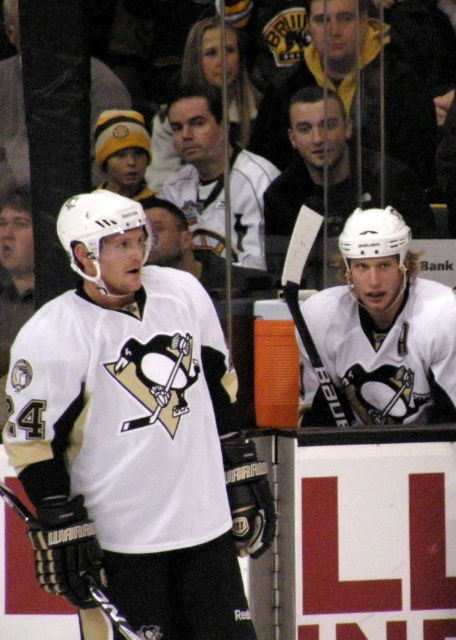
You are a photographer at the ice hockey game. You want to capture a photo where the white matte jersey at left and the black matte hockey stick at upper center are both visible. Based on their positions, which object should appear higher in the photo?

The black matte hockey stick at upper center should appear higher in the photo because the white matte jersey at left is below it.

In the ice hockey game scene, you see the white matte jersey at left and the white matte helmet at upper center. Which object is positioned more to the left side of the image?

The white matte jersey at left is positioned more to the left side of the image than the white matte helmet at upper center.

You are a photographer trying to capture a closeup of the white matte jersey at left and the white matte helmet at upper center in the image. Which object should you zoom in on to ensure both are in focus without moving the camera?

The white matte jersey at left is bigger than the white matte helmet at upper center, so you should zoom in on the white matte jersey at left to ensure both are in focus without moving the camera.